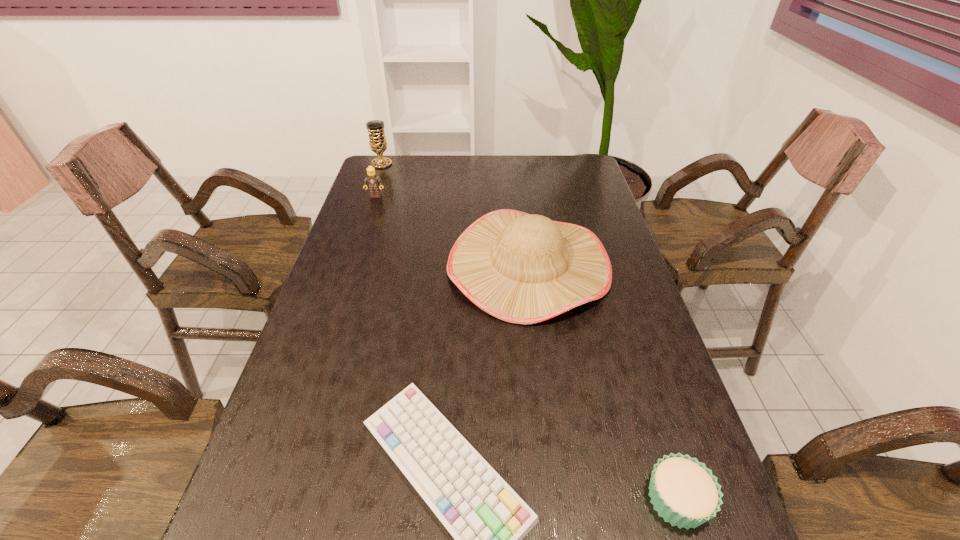
Locate an element on the screen. The height and width of the screenshot is (540, 960). chalice located in the left edge section of the desktop is located at coordinates [x=377, y=140].

This screenshot has width=960, height=540. I want to click on Lego at the left edge, so click(373, 182).

At what (x,y) coordinates should I click in order to perform the action: click on sunhat present at the right edge. Please return your answer as a coordinate pair (x, y). The image size is (960, 540). Looking at the image, I should click on (522, 268).

What are the coordinates of `cupcake present at the right edge` in the screenshot? It's located at (684, 492).

The width and height of the screenshot is (960, 540). Find the location of `object present at the far left corner`. object present at the far left corner is located at coordinates (377, 140).

Identify the location of free space at the far edge. (464, 160).

I want to click on free location at the left edge, so click(319, 315).

Where is `free space at the right edge`? The image size is (960, 540). free space at the right edge is located at coordinates (605, 205).

Where is `vacant space at the far right corner of the desktop`? The height and width of the screenshot is (540, 960). vacant space at the far right corner of the desktop is located at coordinates (553, 179).

You are a GUI agent. You are given a task and a screenshot of the screen. Output one action in this format:
    pyautogui.click(x=<x>, y=<y>)
    Task: Click on the vacant area between the farthest object and the third farthest object
    Image resolution: width=960 pixels, height=540 pixels.
    Given the screenshot: What is the action you would take?
    pyautogui.click(x=455, y=214)